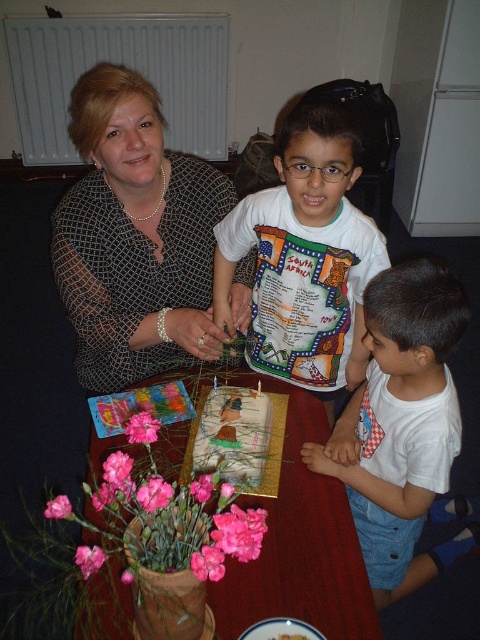
Can you confirm if matte black dress at center is smaller than decorative paper cake at center?

Actually, matte black dress at center might be larger than decorative paper cake at center.

At what (x,y) coordinates should I click in order to perform the action: click on matte black dress at center. Please return your answer as a coordinate pair (x, y). Looking at the image, I should click on (135, 237).

You are a GUI agent. You are given a task and a screenshot of the screen. Output one action in this format:
    pyautogui.click(x=<x>, y=<y>)
    Task: Click on the matte black dress at center
    
    Given the screenshot: What is the action you would take?
    pyautogui.click(x=135, y=237)

Which is behind, point (304, 380) or point (199, 429)?

The point (304, 380) is behind.

Is point (278, 189) positioned before point (216, 429)?

No, (278, 189) is further to viewer.

Between point (299, 170) and point (195, 472), which one is positioned in front?

Point (299, 170) is in front.

I want to click on white printed shirt at center, so click(x=304, y=257).

Can you confirm if matte black dress at center is shorter than smooth wooden table at center?

No, matte black dress at center is not shorter than smooth wooden table at center.

Is point (75, 225) closer to camera compared to point (168, 464)?

No, it is behind (168, 464).

Describe the element at coordinates (135, 237) in the screenshot. I see `matte black dress at center` at that location.

The height and width of the screenshot is (640, 480). Identify the location of matte black dress at center. (135, 237).